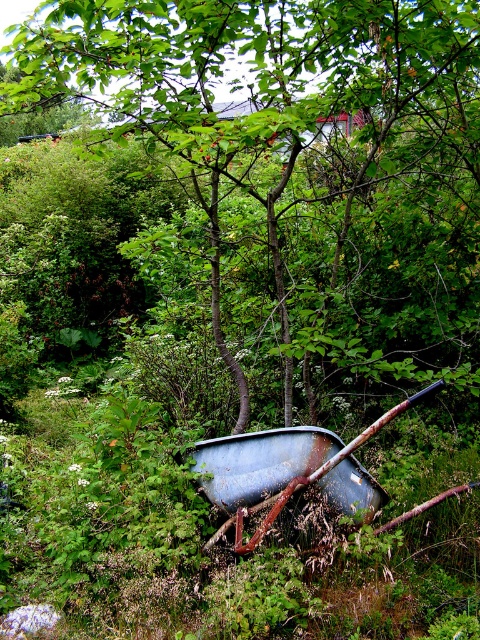
Question: Which point is farther from the camera taking this photo?

Choices:
 (A) (320, 476)
 (B) (86, 36)

Answer: (B)

Question: Among these objects, which one is farthest from the camera?

Choices:
 (A) green leafy tree at center
 (B) rusty metal wheelbarrow at center

Answer: (B)

Question: Does green leafy tree at center have a smaller size compared to rusty metal wheelbarrow at center?

Choices:
 (A) yes
 (B) no

Answer: (B)

Question: Among these objects, which one is farthest from the camera?

Choices:
 (A) green leafy tree at center
 (B) rusty metal wheelbarrow at center

Answer: (B)

Question: Is green leafy tree at center positioned before rusty metal wheelbarrow at center?

Choices:
 (A) no
 (B) yes

Answer: (B)

Question: Does green leafy tree at center lie behind rusty metal wheelbarrow at center?

Choices:
 (A) no
 (B) yes

Answer: (A)